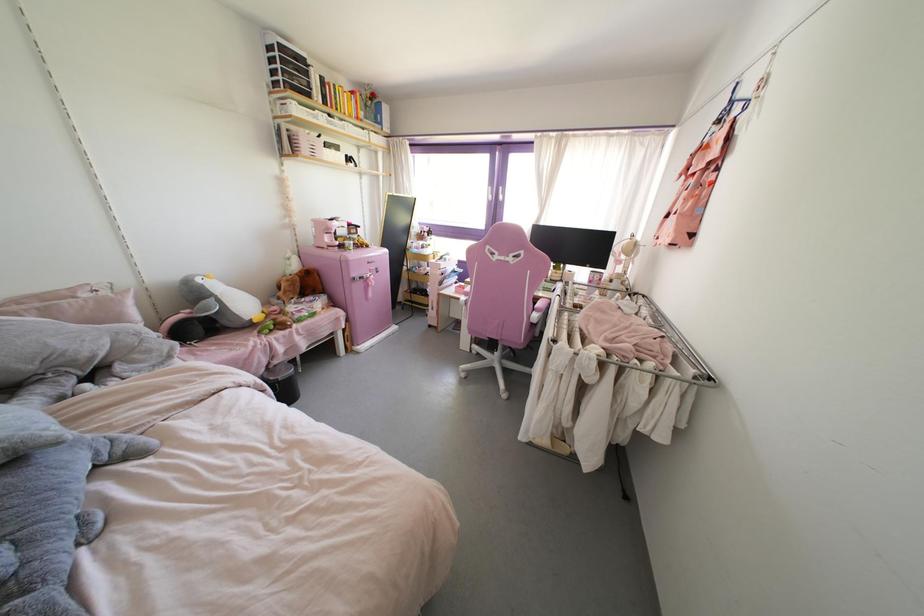
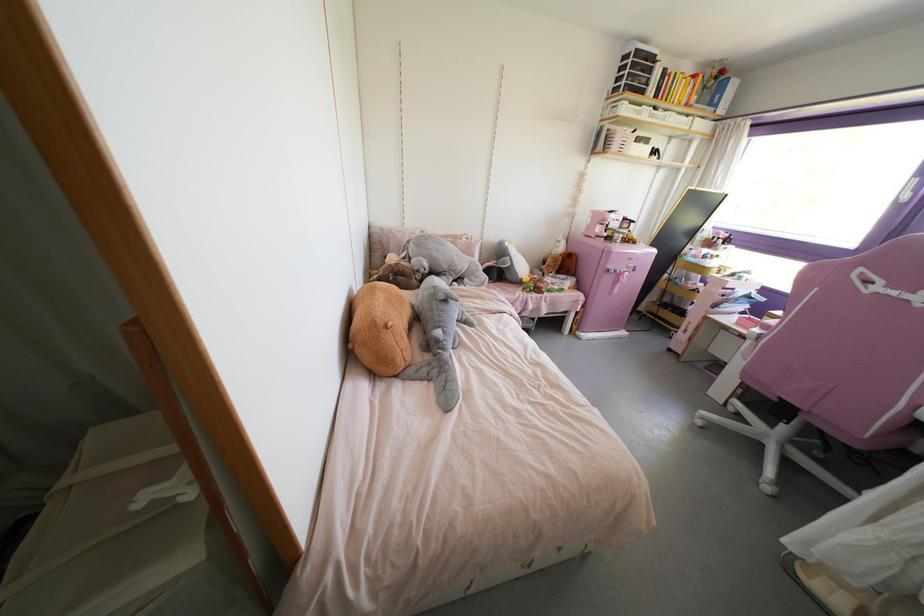
In the second image, find the point that corresponds to [377,272] in the first image.

(633, 270)